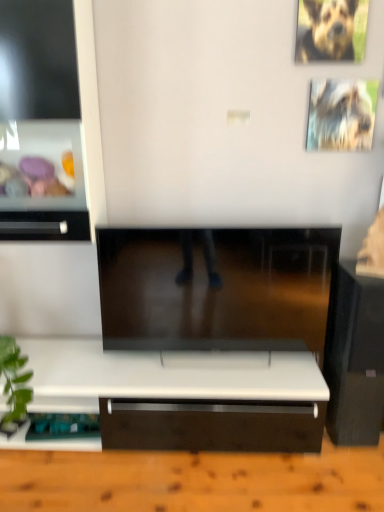
Question: Is black glossy speaker at right closer to the viewer compared to brown fur dog at upper right?

Choices:
 (A) yes
 (B) no

Answer: (A)

Question: Considering the relative positions of black glossy speaker at right and brown fur dog at upper right in the image provided, is black glossy speaker at right to the right of brown fur dog at upper right from the viewer's perspective?

Choices:
 (A) no
 (B) yes

Answer: (B)

Question: Can brown fur dog at upper right be found inside black glossy speaker at right?

Choices:
 (A) yes
 (B) no

Answer: (B)

Question: From the image's perspective, does black glossy speaker at right appear higher than brown fur dog at upper right?

Choices:
 (A) yes
 (B) no

Answer: (B)

Question: Considering the relative sizes of black glossy speaker at right and brown fur dog at upper right in the image provided, is black glossy speaker at right bigger than brown fur dog at upper right?

Choices:
 (A) no
 (B) yes

Answer: (B)

Question: Choose the correct answer: Is black glossy speaker at right inside metallic silver picture frame at upper right or outside it?

Choices:
 (A) inside
 (B) outside

Answer: (B)

Question: Visually, is black glossy speaker at right positioned to the left or to the right of metallic silver picture frame at upper right?

Choices:
 (A) left
 (B) right

Answer: (B)

Question: Considering the positions of black glossy speaker at right and metallic silver picture frame at upper right in the image, is black glossy speaker at right taller or shorter than metallic silver picture frame at upper right?

Choices:
 (A) tall
 (B) short

Answer: (A)

Question: From the image's perspective, relative to metallic silver picture frame at upper right, is black glossy speaker at right above or below?

Choices:
 (A) below
 (B) above

Answer: (A)

Question: Looking at their shapes, would you say brown fur dog at upper right is wider or thinner than black glossy speaker at right?

Choices:
 (A) thin
 (B) wide

Answer: (A)

Question: Is brown fur dog at upper right in front of or behind black glossy speaker at right in the image?

Choices:
 (A) front
 (B) behind

Answer: (B)

Question: From the image's perspective, is brown fur dog at upper right above or below black glossy speaker at right?

Choices:
 (A) above
 (B) below

Answer: (A)

Question: Which is correct: brown fur dog at upper right is inside black glossy speaker at right, or outside of it?

Choices:
 (A) inside
 (B) outside

Answer: (B)

Question: Is metallic silver picture frame at upper right in front of or behind brown fur dog at upper right in the image?

Choices:
 (A) front
 (B) behind

Answer: (B)

Question: Looking at their shapes, would you say metallic silver picture frame at upper right is wider or thinner than brown fur dog at upper right?

Choices:
 (A) wide
 (B) thin

Answer: (B)